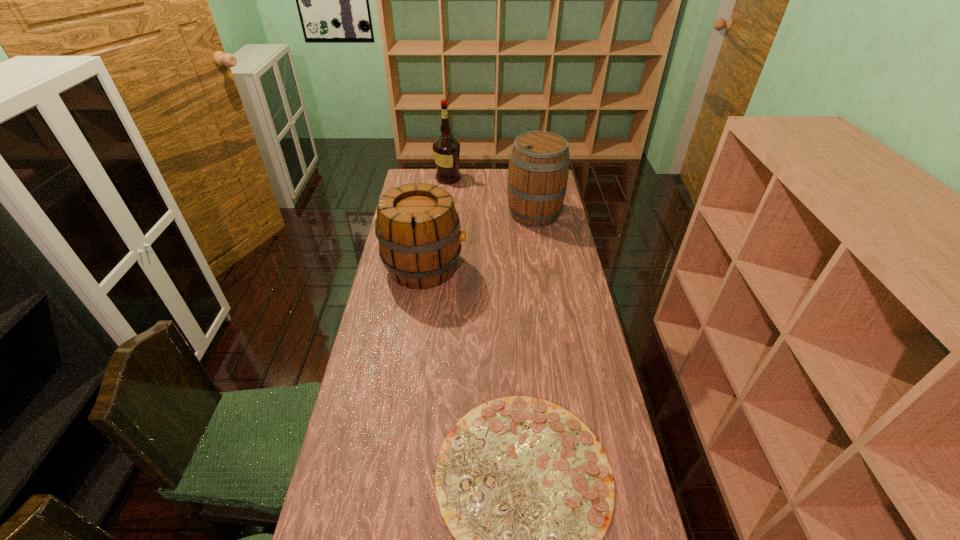
The image size is (960, 540). Find the location of `object that is the second closest one to the third farthest object`. object that is the second closest one to the third farthest object is located at coordinates (526, 489).

Where is `object that is the third closest one to the nearer cider`? The height and width of the screenshot is (540, 960). object that is the third closest one to the nearer cider is located at coordinates (446, 149).

This screenshot has width=960, height=540. What are the coordinates of `vacant area in the image that satisfies the following two spatial constraints: 1. on the label of the farthest object; 2. on the left side of the right cider` in the screenshot? It's located at (444, 214).

The width and height of the screenshot is (960, 540). I want to click on blank space that satisfies the following two spatial constraints: 1. on the front side of the farther cider; 2. on the side of the left cider where the spigot is located, so click(543, 267).

This screenshot has width=960, height=540. Identify the location of vacant region that satisfies the following two spatial constraints: 1. on the label of the alcohol; 2. on the back side of the second farthest object. (444, 214).

You are a GUI agent. You are given a task and a screenshot of the screen. Output one action in this format:
    pyautogui.click(x=<x>, y=<y>)
    Task: Click on the free space that satisfies the following two spatial constraints: 1. on the label of the farthest object; 2. on the left side of the right cider
    Image resolution: width=960 pixels, height=540 pixels.
    Given the screenshot: What is the action you would take?
    pyautogui.click(x=444, y=214)

I want to click on vacant space that satisfies the following two spatial constraints: 1. on the label of the alcohol; 2. on the back side of the second farthest object, so click(x=444, y=214).